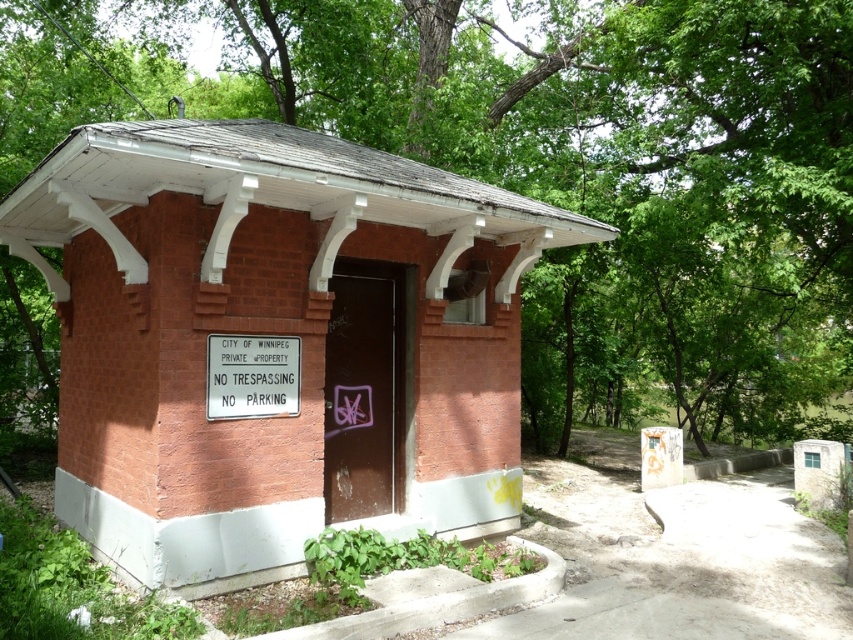
Does green leafy tree at upper center lie in front of white plastic sign at center?

No, green leafy tree at upper center is further to the viewer.

Does green leafy tree at upper center have a lesser height compared to white plastic sign at center?

Incorrect, green leafy tree at upper center's height does not fall short of white plastic sign at center's.

Between point (523, 67) and point (247, 413), which one is positioned in front?

Point (247, 413)

Image resolution: width=853 pixels, height=640 pixels. I want to click on green leafy tree at upper center, so click(621, 180).

Describe the element at coordinates (277, 333) in the screenshot. This screenshot has height=640, width=853. I see `brick hut at center` at that location.

Is brick hut at center closer to camera compared to green leafy tree at upper center?

Yes, it is.

Is point (477, 433) closer to viewer compared to point (809, 212)?

Yes, point (477, 433) is in front of point (809, 212).

The height and width of the screenshot is (640, 853). I want to click on brick hut at center, so click(x=277, y=333).

What are the coordinates of `brick hut at center` in the screenshot? It's located at (277, 333).

Which of these two, brick hut at center or white plastic sign at center, stands taller?

With more height is brick hut at center.

Where is `brick hut at center`? The height and width of the screenshot is (640, 853). brick hut at center is located at coordinates (277, 333).

Locate an element on the screen. The height and width of the screenshot is (640, 853). brick hut at center is located at coordinates (277, 333).